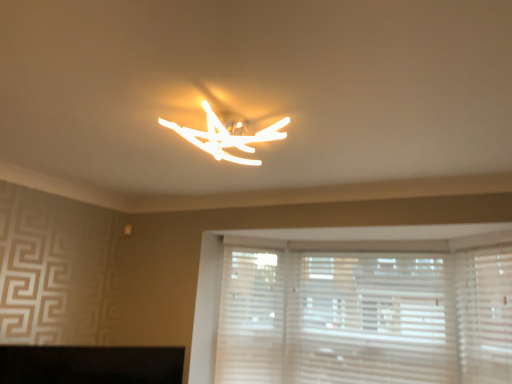
Question: Does white textured blinds at lower right have a larger size compared to white matte shutter at right, the 2th shutter from the left?

Choices:
 (A) yes
 (B) no

Answer: (A)

Question: Considering the relative sizes of white textured blinds at lower right and white matte shutter at right, the 2th shutter from the left, in the image provided, is white textured blinds at lower right shorter than white matte shutter at right, the 2th shutter from the left,?

Choices:
 (A) no
 (B) yes

Answer: (A)

Question: Is white matte shutter at right, which is counted as the 2th shutter, starting from the back, located within white textured blinds at lower right?

Choices:
 (A) no
 (B) yes

Answer: (A)

Question: Is white textured blinds at lower right further to camera compared to white matte shutter at right, the 2th shutter from the left?

Choices:
 (A) yes
 (B) no

Answer: (A)

Question: Could you tell me if white textured blinds at lower right is facing white matte shutter at right, which is counted as the 2th shutter, starting from the back?

Choices:
 (A) no
 (B) yes

Answer: (A)

Question: Visually, is white matte shutter at lower center, which is the 1th shutter in back-to-front order, positioned to the left or to the right of white matte shutter at right, marked as the first shutter in a front-to-back arrangement?

Choices:
 (A) right
 (B) left

Answer: (B)

Question: From the image's perspective, is white matte shutter at lower center, arranged as the 2th shutter when viewed from the right, positioned above or below white matte shutter at right, the 2th shutter from the left?

Choices:
 (A) above
 (B) below

Answer: (B)

Question: Considering the positions of white matte shutter at lower center, positioned as the second shutter in front-to-back order, and white matte shutter at right, positioned as the first shutter in right-to-left order, in the image, is white matte shutter at lower center, positioned as the second shutter in front-to-back order, taller or shorter than white matte shutter at right, positioned as the first shutter in right-to-left order,?

Choices:
 (A) short
 (B) tall

Answer: (B)

Question: From a real-world perspective, is white matte shutter at lower center, which is the 1th shutter in back-to-front order, positioned above or below white matte shutter at right, which is counted as the 2th shutter, starting from the back?

Choices:
 (A) above
 (B) below

Answer: (B)

Question: Is white textured blinds at lower right inside or outside of white matte shutter at right, marked as the first shutter in a front-to-back arrangement?

Choices:
 (A) inside
 (B) outside

Answer: (B)

Question: Considering the positions of point coord(309,254) and point coord(476,271), is point coord(309,254) closer or farther from the camera than point coord(476,271)?

Choices:
 (A) farther
 (B) closer

Answer: (A)

Question: From their relative heights in the image, would you say white textured blinds at lower right is taller or shorter than white matte shutter at right, the 2th shutter from the left?

Choices:
 (A) tall
 (B) short

Answer: (A)

Question: Is white textured blinds at lower right bigger or smaller than white matte shutter at right, which is counted as the 2th shutter, starting from the back?

Choices:
 (A) small
 (B) big

Answer: (B)

Question: Which is correct: white textured blinds at lower right is inside matte white light fixture at center, or outside of it?

Choices:
 (A) outside
 (B) inside

Answer: (A)

Question: Does point 348,352 appear closer or farther from the camera than point 212,155?

Choices:
 (A) closer
 (B) farther

Answer: (B)